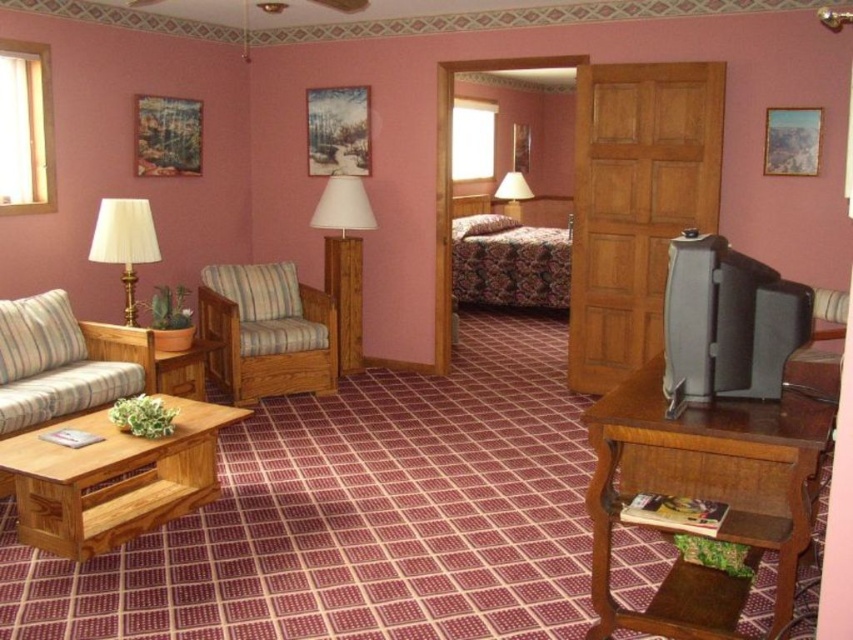
Is point (86, 480) positioned behind point (218, 348)?

No, it is in front of (218, 348).

Is light brown wooden coffee table at lower left shorter than wooden coffee table at lower left?

No.

The width and height of the screenshot is (853, 640). I want to click on light brown wooden coffee table at lower left, so click(x=113, y=477).

This screenshot has width=853, height=640. Identify the location of light brown wooden coffee table at lower left. coord(113,477).

Who is higher up, striped fabric armchair at center or wooden floor lamp at center?

wooden floor lamp at center is above.

Can you confirm if striped fabric armchair at center is smaller than wooden floor lamp at center?

Actually, striped fabric armchair at center might be larger than wooden floor lamp at center.

Between point (235, 403) and point (343, 276), which one is positioned behind?

Positioned behind is point (343, 276).

This screenshot has height=640, width=853. I want to click on striped fabric armchair at center, so click(265, 332).

Can you confirm if striped fabric armchair at center is positioned to the right of white pleated fabric lampshade at left?

Yes, striped fabric armchair at center is to the right of white pleated fabric lampshade at left.

Is point (238, 323) closer to camera compared to point (106, 225)?

That is False.

Identify the location of striped fabric armchair at center. (265, 332).